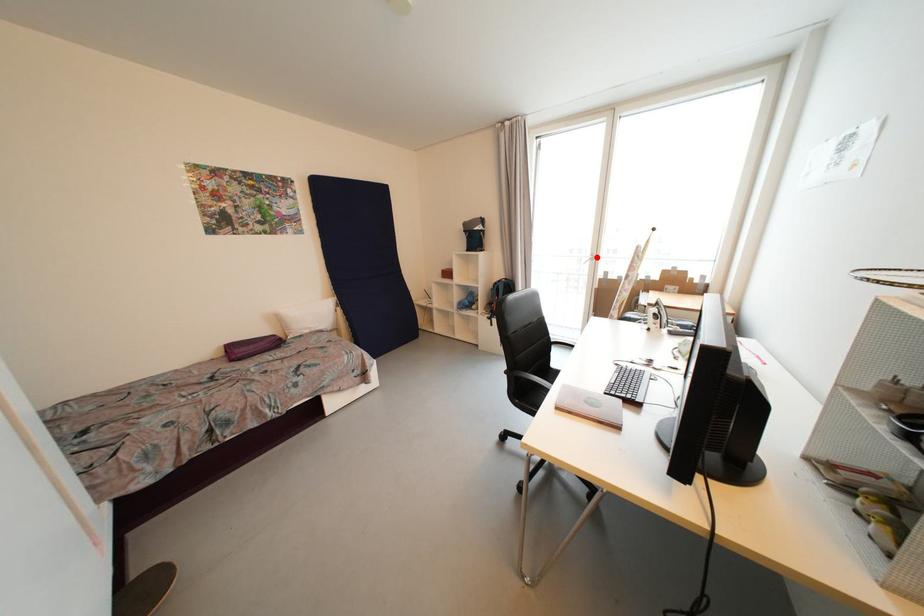
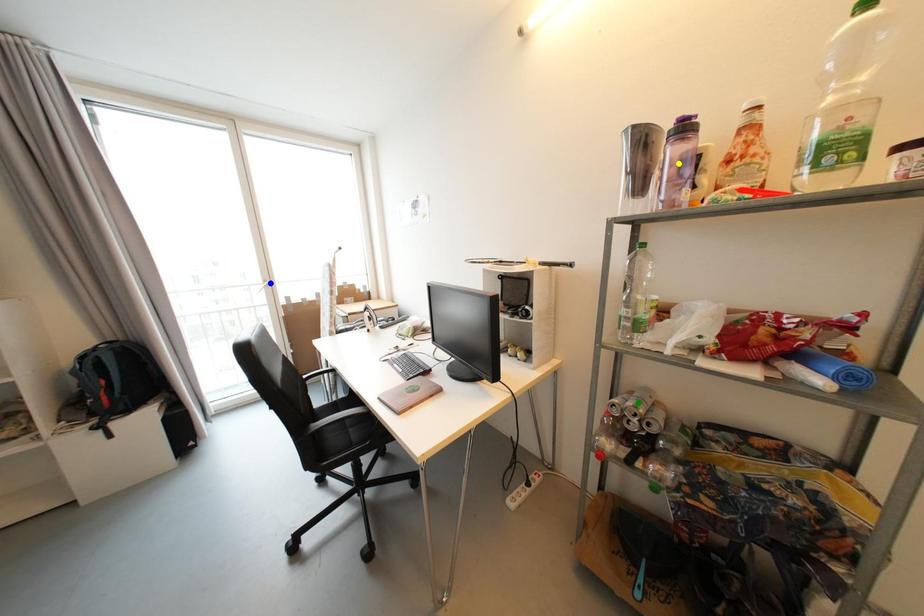
Question: I am providing you with two images of the same scene from different viewpoints. A red point is marked on the first image. You are given multiple points on the second image. Which mark in image 2 goes with the point in image 1?

Choices:
 (A) yellow point
 (B) green point
 (C) blue point

Answer: (C)